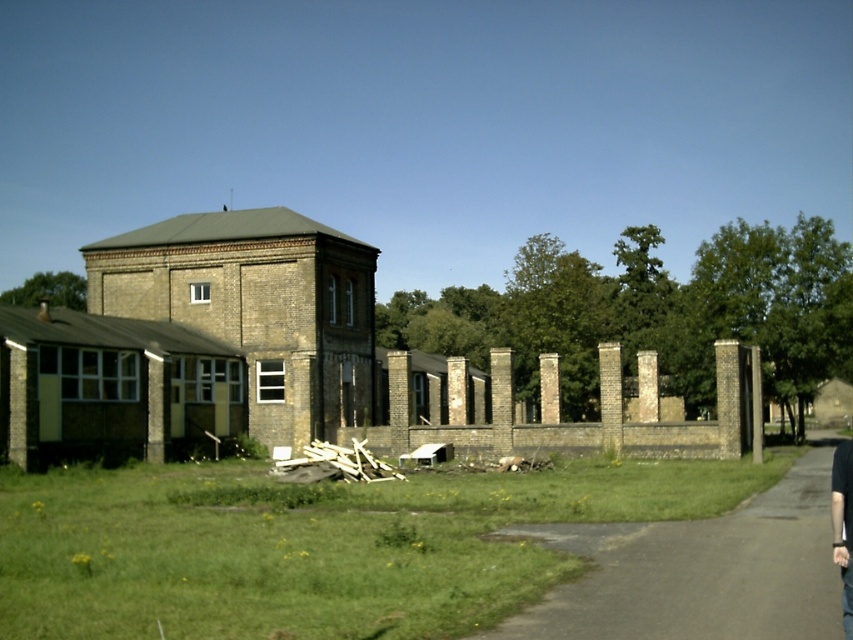
Which of these two, wooden planks at center or black fabric pants at lower right, stands taller?

black fabric pants at lower right

Does wooden planks at center lie in front of black fabric pants at lower right?

No, wooden planks at center is further to the viewer.

Which is in front, point (378, 461) or point (842, 444)?

Point (378, 461) is more forward.

I want to click on wooden planks at center, so click(x=335, y=465).